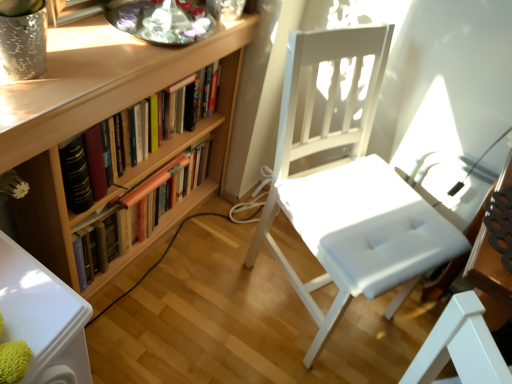
Question: Is wooden bookshelf at left, the second book ordered from the bottom, not near wooden bookshelf at left, the 1th book positioned from the bottom?

Choices:
 (A) yes
 (B) no

Answer: (B)

Question: Can you confirm if wooden bookshelf at left, the second book ordered from the bottom, is wider than wooden bookshelf at left, the 1th book positioned from the bottom?

Choices:
 (A) yes
 (B) no

Answer: (B)

Question: Can you confirm if wooden bookshelf at left, the first book positioned from the top, is shorter than wooden bookshelf at left, marked as the second book in a top-to-bottom arrangement?

Choices:
 (A) yes
 (B) no

Answer: (A)

Question: Is wooden bookshelf at left, the second book ordered from the bottom, outside wooden bookshelf at left, the 1th book positioned from the bottom?

Choices:
 (A) no
 (B) yes

Answer: (B)

Question: From the image's perspective, is wooden bookshelf at left, the second book ordered from the bottom, beneath wooden bookshelf at left, marked as the second book in a top-to-bottom arrangement?

Choices:
 (A) yes
 (B) no

Answer: (B)

Question: Is point (54, 168) positioned closer to the camera than point (137, 218)?

Choices:
 (A) closer
 (B) farther

Answer: (A)

Question: Considering the positions of wooden bookcase at left and wooden bookshelf at left, marked as the second book in a top-to-bottom arrangement, in the image, is wooden bookcase at left taller or shorter than wooden bookshelf at left, marked as the second book in a top-to-bottom arrangement,?

Choices:
 (A) tall
 (B) short

Answer: (A)

Question: Is wooden bookcase at left in front of or behind wooden bookshelf at left, marked as the second book in a top-to-bottom arrangement, in the image?

Choices:
 (A) front
 (B) behind

Answer: (A)

Question: Looking at the image, does wooden bookcase at left seem bigger or smaller compared to wooden bookshelf at left, marked as the second book in a top-to-bottom arrangement?

Choices:
 (A) big
 (B) small

Answer: (A)

Question: Is point (109, 221) closer or farther from the camera than point (371, 117)?

Choices:
 (A) closer
 (B) farther

Answer: (A)

Question: Considering the relative positions of wooden bookshelf at left, marked as the second book in a top-to-bottom arrangement, and white leather chair at center in the image provided, is wooden bookshelf at left, marked as the second book in a top-to-bottom arrangement, to the left or to the right of white leather chair at center?

Choices:
 (A) right
 (B) left

Answer: (B)

Question: In terms of height, does wooden bookshelf at left, marked as the second book in a top-to-bottom arrangement, look taller or shorter compared to white leather chair at center?

Choices:
 (A) tall
 (B) short

Answer: (B)

Question: From the image's perspective, is wooden bookshelf at left, the 1th book positioned from the bottom, above or below white leather chair at center?

Choices:
 (A) above
 (B) below

Answer: (A)

Question: Based on their sizes in the image, would you say wooden bookshelf at left, the second book ordered from the bottom, is bigger or smaller than wooden bookshelf at left, the 1th book positioned from the bottom?

Choices:
 (A) big
 (B) small

Answer: (B)

Question: In terms of height, does wooden bookshelf at left, the first book positioned from the top, look taller or shorter compared to wooden bookshelf at left, marked as the second book in a top-to-bottom arrangement?

Choices:
 (A) short
 (B) tall

Answer: (A)